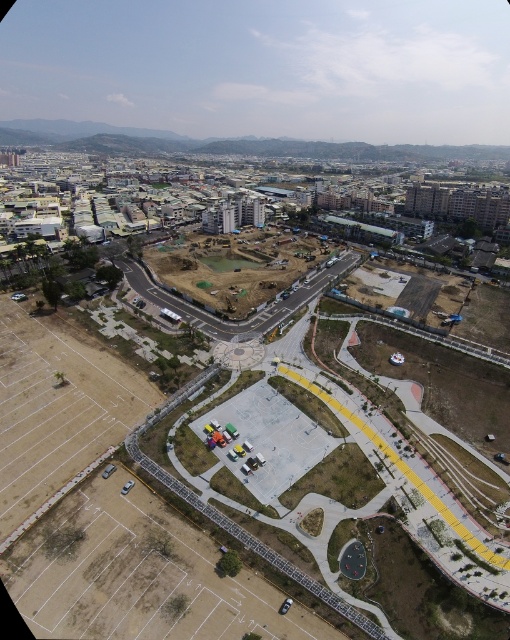
Question: Can you confirm if concrete asphalt race track at lower left is positioned to the right of brown dirt at center?

Choices:
 (A) yes
 (B) no

Answer: (B)

Question: Which point is farther to the camera?

Choices:
 (A) (190, 305)
 (B) (304, 433)

Answer: (A)

Question: Can you confirm if concrete asphalt race track at lower left is positioned below brown dirt at center?

Choices:
 (A) yes
 (B) no

Answer: (A)

Question: Is concrete asphalt race track at lower left closer to the viewer compared to brown dirt at center?

Choices:
 (A) no
 (B) yes

Answer: (B)